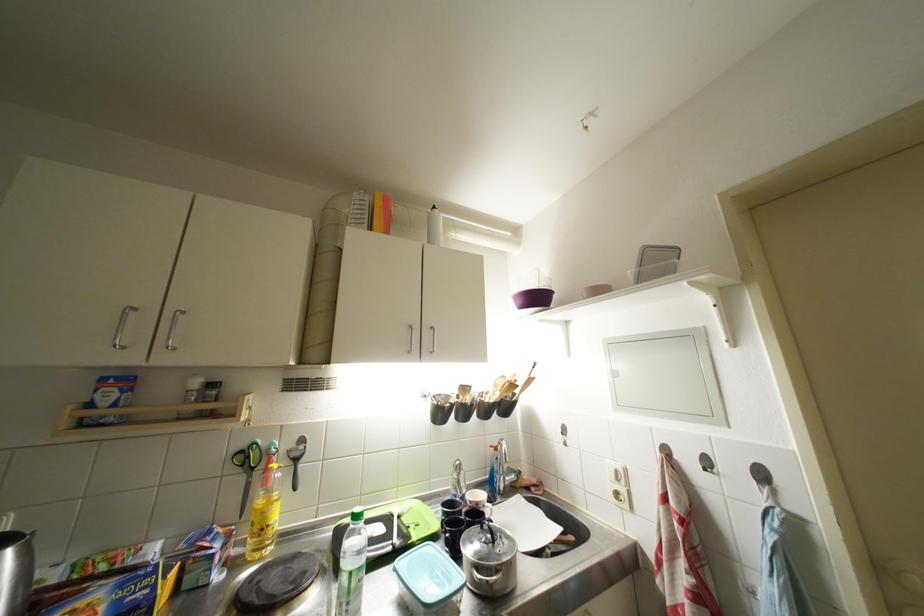
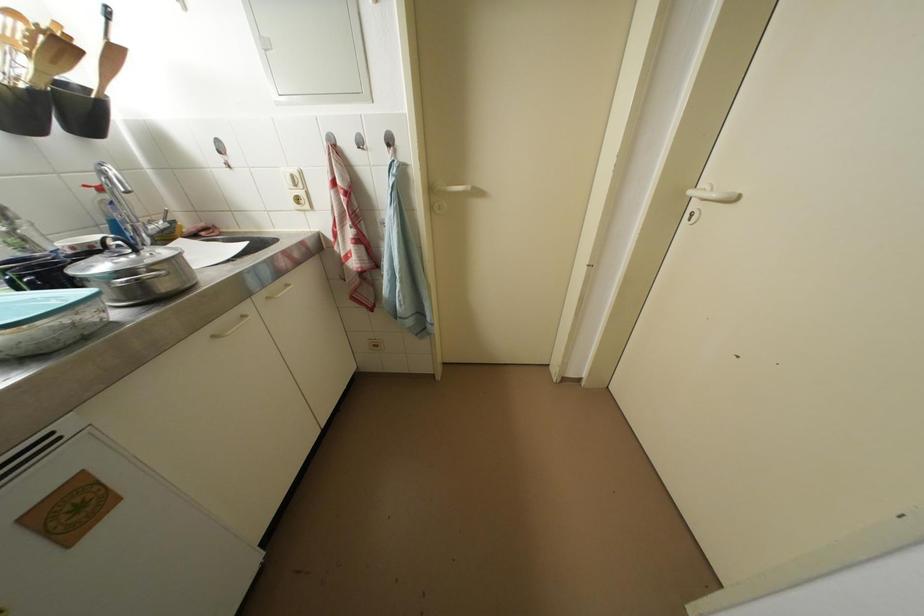
Where in the second image is the point corresponding to point 514,483 from the first image?

(157, 231)